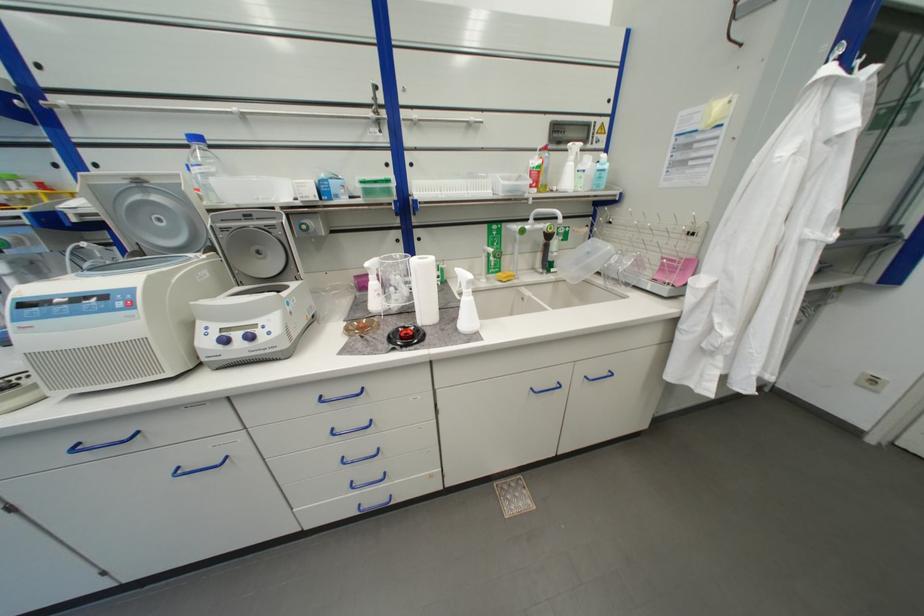
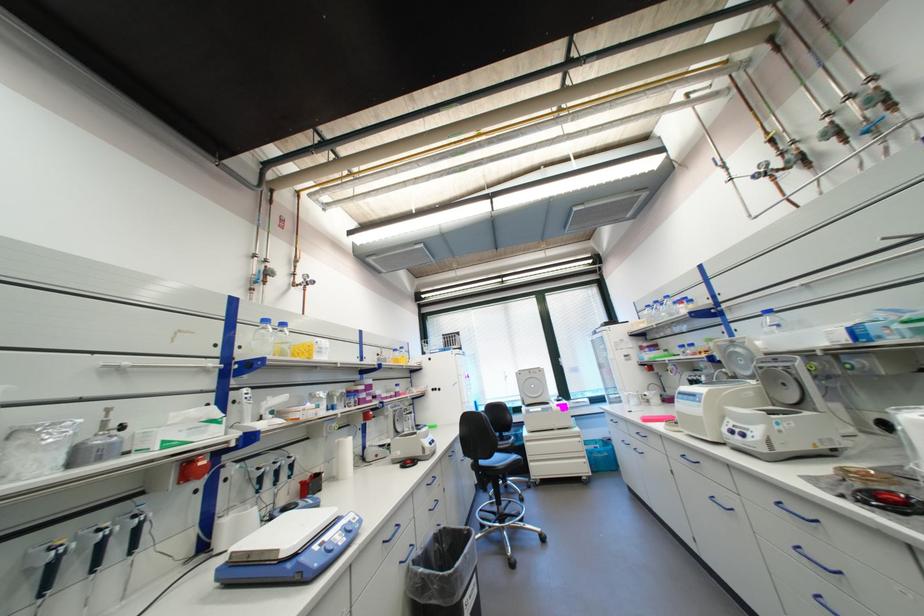
Locate, in the second image, the point that corresponds to (x=205, y=140) in the first image.

(776, 312)